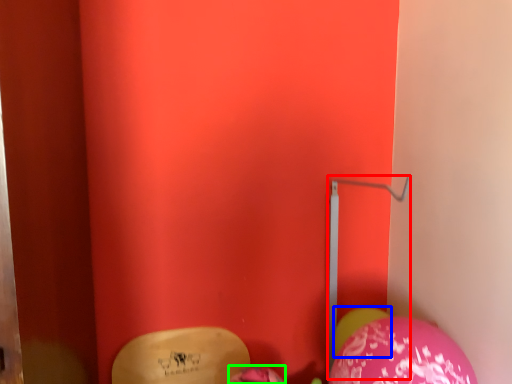
Question: Which is nearer to the trim (highlighted by a red box)? balloon (highlighted by a blue box) or balloon (highlighted by a green box).

Choices:
 (A) balloon
 (B) balloon

Answer: (A)